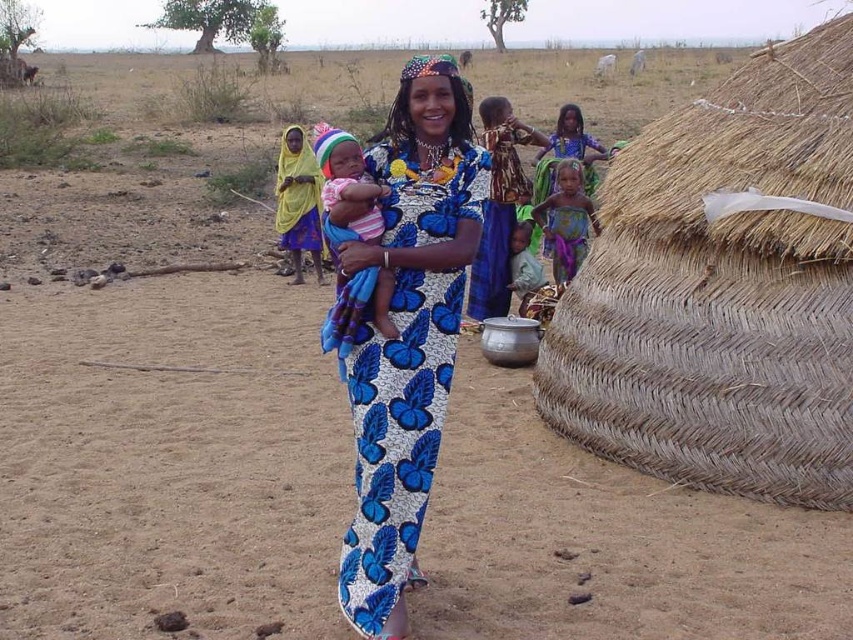
Between blue printed dress at center and light green fabric at lower center, which one appears on the left side from the viewer's perspective?

From the viewer's perspective, blue printed dress at center appears more on the left side.

Who is more forward, (x=352, y=586) or (x=518, y=228)?

Point (x=352, y=586) is more forward.

What do you see at coordinates (408, 333) in the screenshot? I see `blue printed dress at center` at bounding box center [408, 333].

In order to click on blue printed dress at center in this screenshot , I will do coord(408,333).

Does striped fabric baby at center have a smaller size compared to purple fabric dress at center?

Yes, striped fabric baby at center is smaller than purple fabric dress at center.

Is striped fabric baby at center shorter than purple fabric dress at center?

Yes, striped fabric baby at center is shorter than purple fabric dress at center.

What do you see at coordinates (341, 168) in the screenshot? I see `striped fabric baby at center` at bounding box center [341, 168].

Image resolution: width=853 pixels, height=640 pixels. I want to click on striped fabric baby at center, so click(x=341, y=168).

Can you confirm if blue printed dress at center is smaller than purple fabric dress at center?

Incorrect, blue printed dress at center is not smaller in size than purple fabric dress at center.

Is point (482, 170) positioned in front of point (575, 262)?

Yes, point (482, 170) is closer to viewer.

Where is `blue printed dress at center`? blue printed dress at center is located at coordinates (408, 333).

Where is `blue printed dress at center`? The height and width of the screenshot is (640, 853). blue printed dress at center is located at coordinates (408, 333).